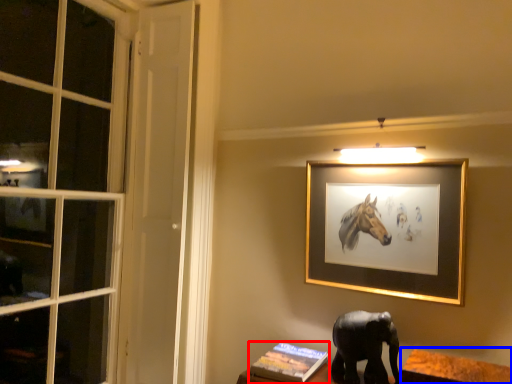
Question: Among these objects, which one is farthest to the camera, book (highlighted by a red box) or table (highlighted by a blue box)?

Choices:
 (A) book
 (B) table

Answer: (A)